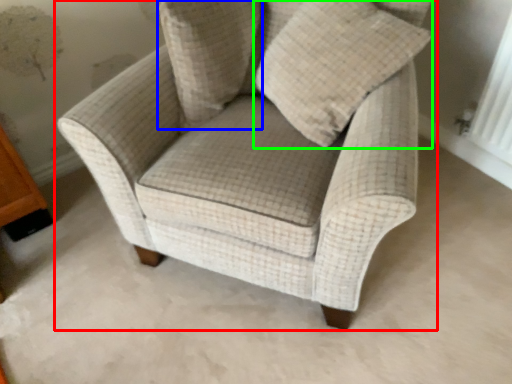
Question: Estimate the real-world distances between objects in this image. Which object is farther from chair (highlighted by a red box), pillow (highlighted by a blue box) or throw pillow (highlighted by a green box)?

Choices:
 (A) pillow
 (B) throw pillow

Answer: (A)